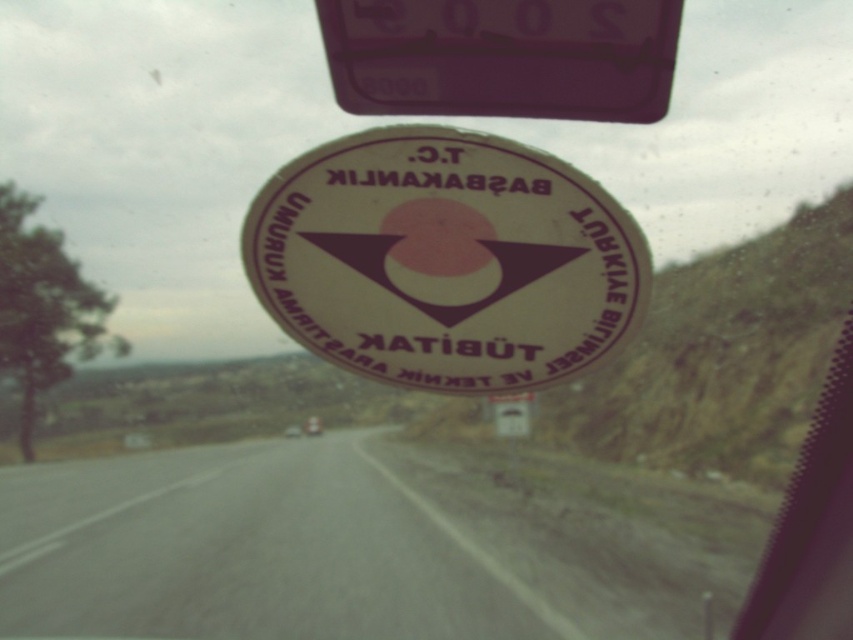
Question: Which of the following is the closest to the observer?

Choices:
 (A) purple glossy traffic sign at upper center
 (B) gray asphalt road at center

Answer: (A)

Question: Can you confirm if gray asphalt road at center is positioned to the right of purple glossy traffic sign at upper center?

Choices:
 (A) yes
 (B) no

Answer: (B)

Question: Is white glossy sticker at center smaller than purple glossy traffic sign at upper center?

Choices:
 (A) yes
 (B) no

Answer: (B)

Question: Estimate the real-world distances between objects in this image. Which object is farther from the purple glossy traffic sign at upper center?

Choices:
 (A) gray asphalt road at center
 (B) white glossy sticker at center

Answer: (A)

Question: Observing the image, what is the correct spatial positioning of gray asphalt road at center in reference to purple glossy traffic sign at upper center?

Choices:
 (A) right
 (B) left

Answer: (B)

Question: Which object is farther from the camera taking this photo?

Choices:
 (A) gray asphalt road at center
 (B) white glossy sticker at center
 (C) purple glossy traffic sign at upper center

Answer: (A)